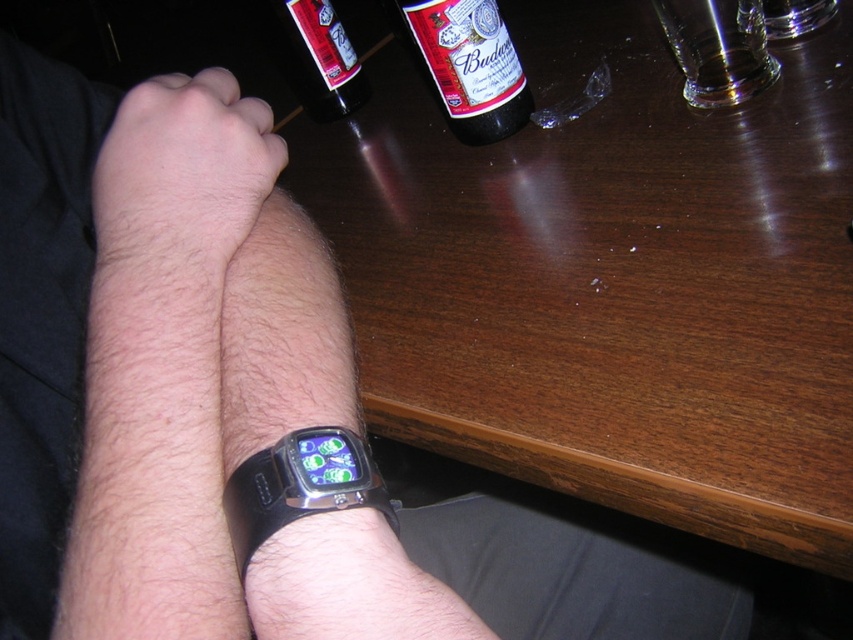
Who is shorter, hair/fuzzy skin at upper center or bottle glass at upper center?

bottle glass at upper center

Consider the image. Measure the distance between point [122,193] and camera.

38.41 centimeters

The width and height of the screenshot is (853, 640). I want to click on hair/fuzzy skin at upper center, so click(183, 172).

The image size is (853, 640). What are the coordinates of `black rubber watch at lower center` in the screenshot? It's located at (300, 484).

Can you confirm if hair/fuzzy skin at upper center is positioned above transparent glass mug at upper center?

Incorrect, hair/fuzzy skin at upper center is not positioned above transparent glass mug at upper center.

Between hair/fuzzy skin at upper center and transparent glass mug at upper center, which one is positioned lower?

hair/fuzzy skin at upper center

Is point (160, 180) less distant than point (662, 10)?

Yes, point (160, 180) is in front of point (662, 10).

Locate an element on the screen. hair/fuzzy skin at upper center is located at coordinates (183, 172).